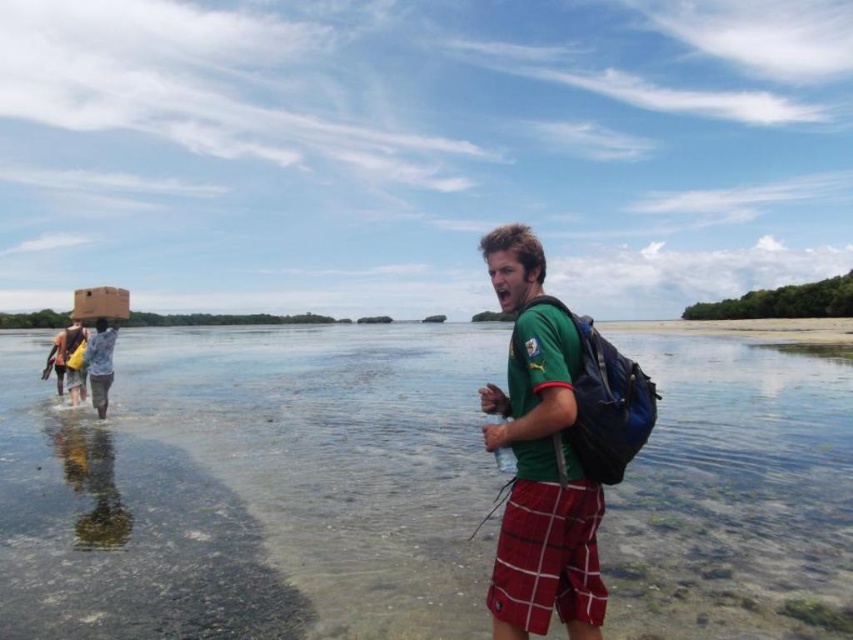
Between clear water at center and green fabric shirt at center, which one has less height?

With less height is clear water at center.

From the picture: Measure the distance between clear water at center and camera.

They are 6.49 meters apart.

Who is more forward, (20, 429) or (584, 618)?

Point (584, 618) is in front.

The width and height of the screenshot is (853, 640). I want to click on clear water at center, so pos(251,486).

From the picture: Who is more forward, (97, 396) or (114, 300)?

Point (114, 300)

Between point (96, 401) and point (91, 288), which one is positioned in front?

Point (91, 288)

Where is `light blue fabric shirt at left`? light blue fabric shirt at left is located at coordinates (100, 364).

Does green fabric shirt at center have a larger size compared to matte cardboard box at left?

Correct, green fabric shirt at center is larger in size than matte cardboard box at left.

The height and width of the screenshot is (640, 853). What do you see at coordinates (538, 458) in the screenshot? I see `green fabric shirt at center` at bounding box center [538, 458].

Image resolution: width=853 pixels, height=640 pixels. I want to click on green fabric shirt at center, so click(x=538, y=458).